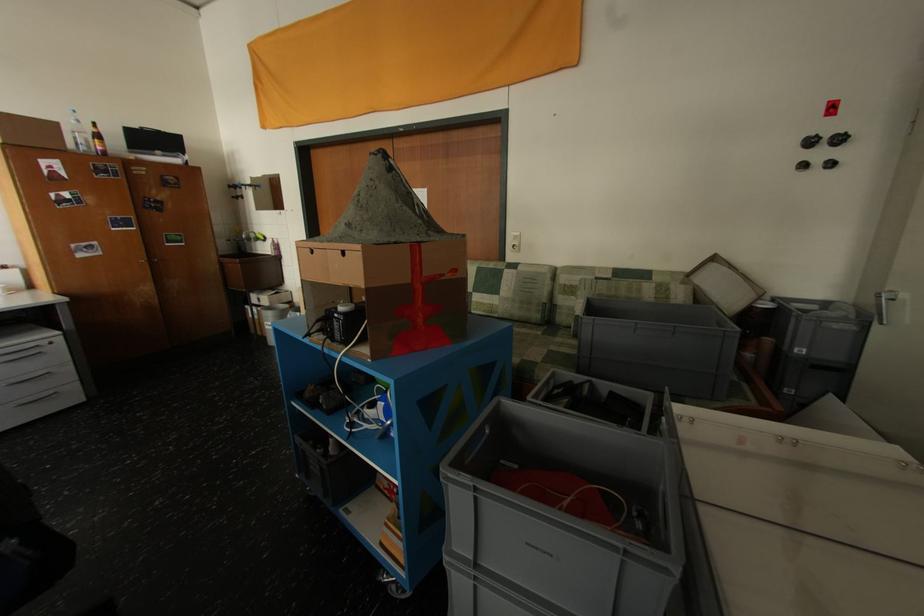
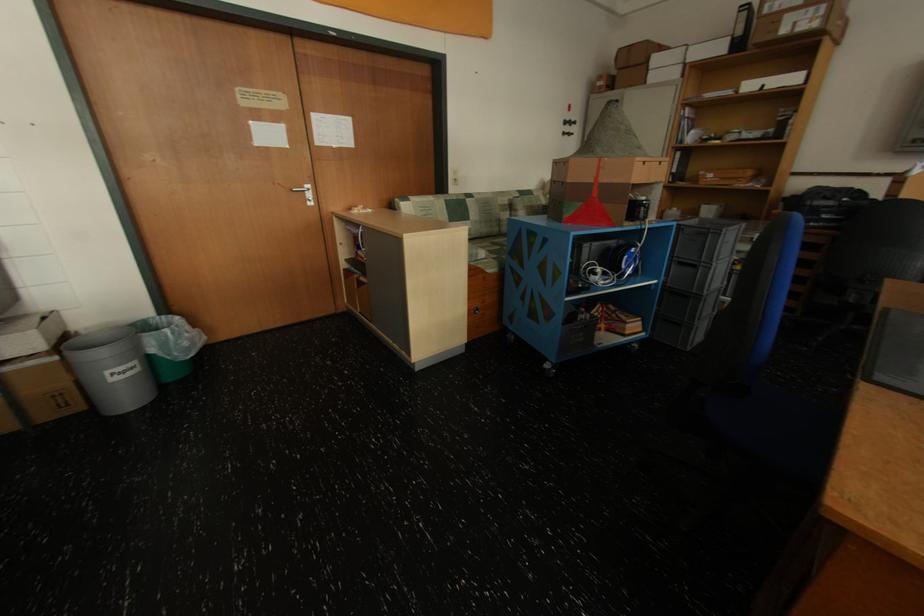
Locate, in the second image, the point that corresponds to [515,272] in the first image.

(476, 201)